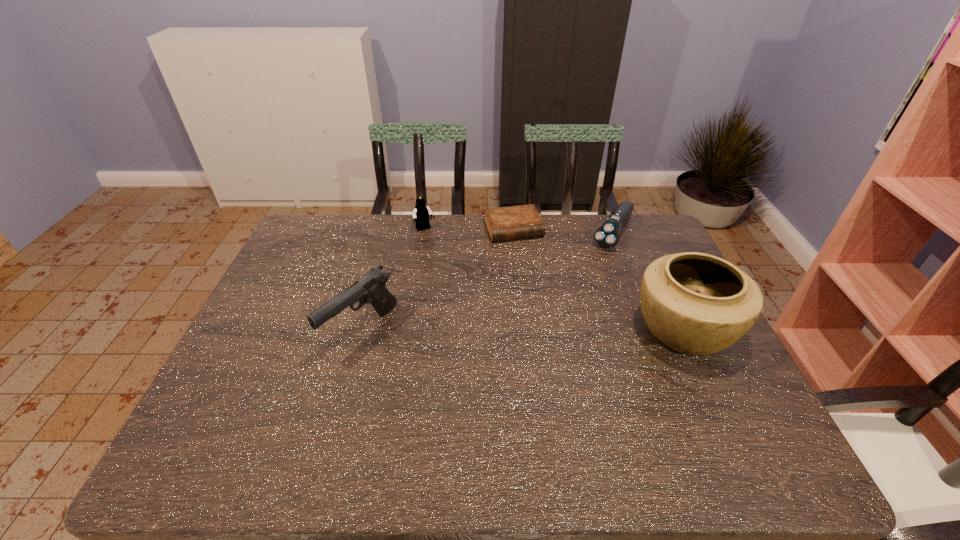
Locate an element on the screen. vacant space at the near left corner of the desktop is located at coordinates (266, 408).

At what (x,y) coordinates should I click in order to perform the action: click on vacant area that lies between the second object from left to right and the second tallest object. Please return your answer as a coordinate pair (x, y). Looking at the image, I should click on (394, 280).

Find the location of a particular element. Image resolution: width=960 pixels, height=540 pixels. unoccupied position between the electric shaver and the shortest object is located at coordinates (563, 231).

Identify the location of free spot between the pottery and the fourth shortest object. This screenshot has height=540, width=960. (522, 329).

What are the coordinates of `free space that is in between the second tallest object and the second shortest object` in the screenshot? It's located at (487, 282).

The width and height of the screenshot is (960, 540). I want to click on free area in between the second object from left to right and the third object from right to left, so click(x=469, y=230).

At what (x,y) coordinates should I click in order to perform the action: click on empty space between the second tallest object and the third tallest object. Please return your answer as a coordinate pair (x, y). Looking at the image, I should click on (394, 280).

Image resolution: width=960 pixels, height=540 pixels. Identify the location of unoccupied area between the second tallest object and the electric shaver. (487, 282).

Find the location of a particular element. The height and width of the screenshot is (540, 960). free space between the second shortest object and the shortest object is located at coordinates (563, 231).

The height and width of the screenshot is (540, 960). I want to click on free space that is in between the third object from right to left and the second shortest object, so click(x=563, y=231).